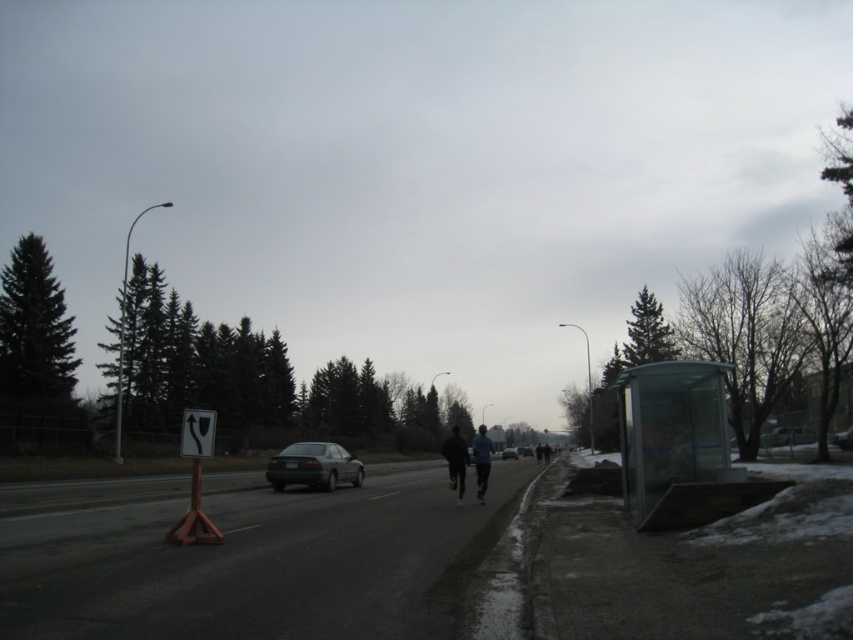
The height and width of the screenshot is (640, 853). Find the location of `dark matte jacket at center`. dark matte jacket at center is located at coordinates (456, 460).

Is dark matte jacket at center to the left of metallic silver sedan at center from the viewer's perspective?

Yes, dark matte jacket at center is to the left of metallic silver sedan at center.

Who is more forward, (460, 451) or (772, 442)?

Positioned in front is point (460, 451).

Locate an element on the screen. The height and width of the screenshot is (640, 853). dark matte jacket at center is located at coordinates (456, 460).

Who is more distant from viewer, (x=445, y=442) or (x=838, y=435)?

The point (x=445, y=442) is more distant.

Is dark matte jacket at center taller than metallic gray sedan at center?

Correct, dark matte jacket at center is much taller as metallic gray sedan at center.

Between point (451, 452) and point (843, 440), which one is positioned in front?

Point (451, 452)

At what (x,y) coordinates should I click in order to perform the action: click on dark matte jacket at center. Please return your answer as a coordinate pair (x, y). This screenshot has width=853, height=640. Looking at the image, I should click on (456, 460).

Is satin silver sedan at center to the right of dark matte jacket at center from the viewer's perspective?

No, satin silver sedan at center is not to the right of dark matte jacket at center.

Can you confirm if satin silver sedan at center is taller than dark matte jacket at center?

In fact, satin silver sedan at center may be shorter than dark matte jacket at center.

Which is in front, point (340, 448) or point (451, 451)?

Point (451, 451) is in front.

The width and height of the screenshot is (853, 640). What are the coordinates of `satin silver sedan at center` in the screenshot? It's located at (312, 467).